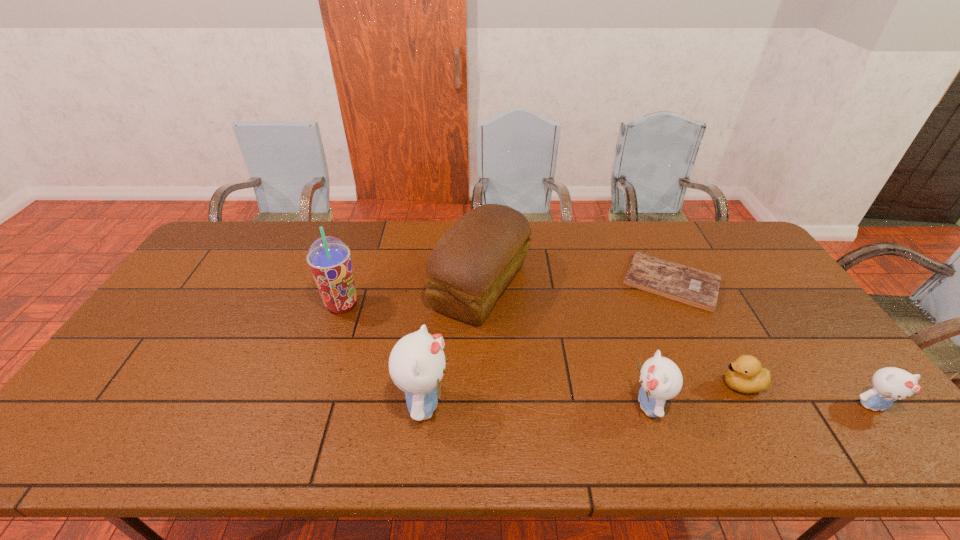
Identify the location of Bible that is at the far edge. Image resolution: width=960 pixels, height=540 pixels. (691, 286).

You are a GUI agent. You are given a task and a screenshot of the screen. Output one action in this format:
    pyautogui.click(x=<x>, y=<y>)
    Task: Click on the bread that is positioned at the far edge
    The height and width of the screenshot is (540, 960).
    Given the screenshot: What is the action you would take?
    pyautogui.click(x=472, y=263)

The image size is (960, 540). I want to click on duckling that is positioned at the near edge, so click(745, 375).

Where is `object that is at the right edge`? The width and height of the screenshot is (960, 540). object that is at the right edge is located at coordinates (889, 384).

Where is `object located at the near right corner`? This screenshot has height=540, width=960. object located at the near right corner is located at coordinates (889, 384).

Where is `vacant area at the far edge of the desktop`? This screenshot has height=540, width=960. vacant area at the far edge of the desktop is located at coordinates (636, 230).

Find the location of a particular element. The height and width of the screenshot is (540, 960). vacant space at the near edge of the desktop is located at coordinates (712, 416).

Identify the location of free space at the left edge of the desktop. (158, 330).

At what (x,y) coordinates should I click in order to perform the action: click on blank space at the right edge. Please return your answer as a coordinate pair (x, y). The image size is (960, 540). Looking at the image, I should click on (813, 334).

In order to click on free spot at the far right corner of the desktop in this screenshot , I will do `click(709, 227)`.